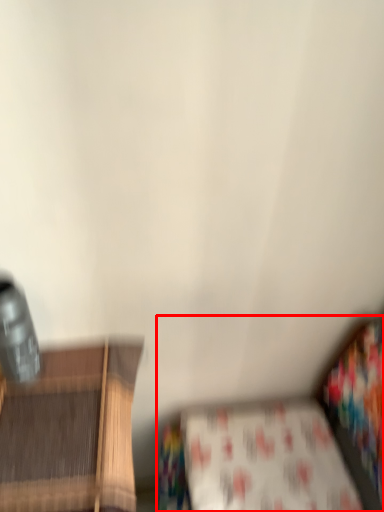
Question: From the image's perspective, considering the relative positions of studio couch (annotated by the red box) and sheet in the image provided, where is studio couch (annotated by the red box) located with respect to the staircase?

Choices:
 (A) above
 (B) below

Answer: (B)